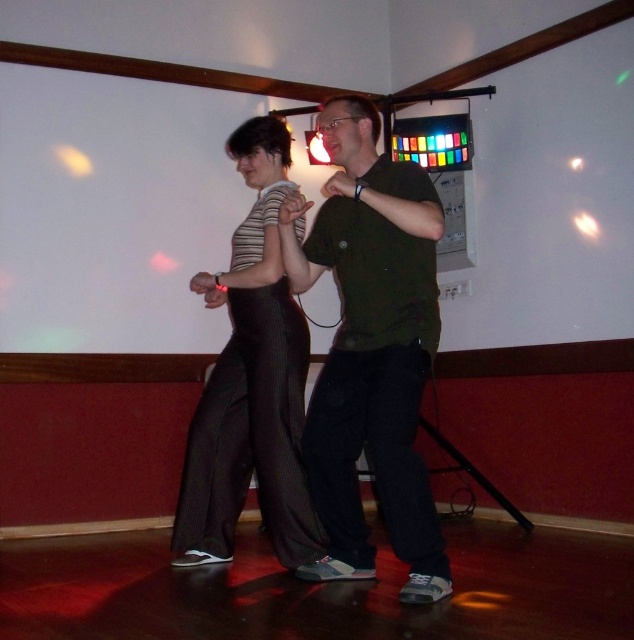
Based on the photo, what is located at the coordinates point (370, 349) in the image?

The green matte shirt at center is located at point (370, 349).

You are a photographer setting up for a photoshoot in the room described. You need to position a spotlight so it illuminates both the green matte shirt at center and the striped fabric pants at center without casting shadows on the white walls. Considering their heights, which object should be placed closer to the spotlight to avoid shadows?

The green matte shirt at center is shorter than the striped fabric pants at center, so the green matte shirt at center should be placed closer to the spotlight to ensure both are illuminated without casting shadows on the white walls.

Based on the scene description, where is the green matte shirt at center located in terms of coordinates?

The green matte shirt at center is located at coordinates point (370, 349).